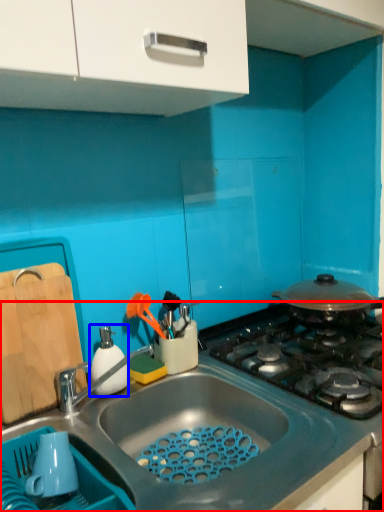
Question: Which object appears closest to the camera in this image, countertop (highlighted by a red box) or appliance (highlighted by a blue box)?

Choices:
 (A) countertop
 (B) appliance

Answer: (A)